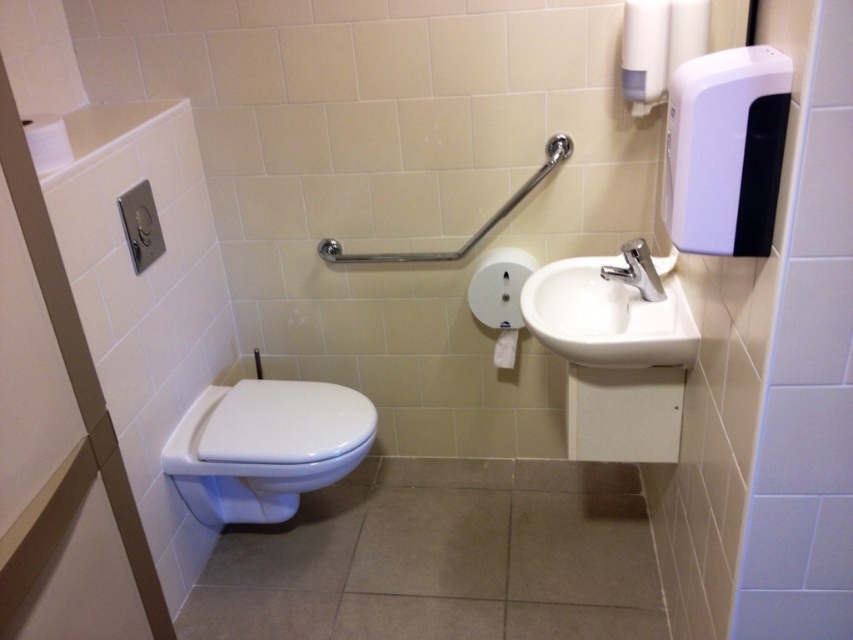
In the scene shown: Does silver metallic faucet at upper right have a lesser width compared to white matte toilet paper at center?

In fact, silver metallic faucet at upper right might be wider than white matte toilet paper at center.

Is point (614, 276) in front of point (494, 349)?

Yes, point (614, 276) is closer to viewer.

In order to click on silver metallic faucet at upper right in this screenshot , I will do `click(636, 269)`.

Between white glossy bidet at lower left and white matte toilet paper at center, which one has more height?

With more height is white glossy bidet at lower left.

Can you confirm if white glossy bidet at lower left is smaller than white matte toilet paper at center?

Incorrect, white glossy bidet at lower left is not smaller in size than white matte toilet paper at center.

Between point (207, 513) and point (509, 332), which one is positioned behind?

The point (509, 332) is more distant.

Where is `white glossy bidet at lower left`? The image size is (853, 640). white glossy bidet at lower left is located at coordinates (265, 448).

At what (x,y) coordinates should I click in order to perform the action: click on white glossy bidet at lower left. Please return your answer as a coordinate pair (x, y). Looking at the image, I should click on (265, 448).

Between point (258, 396) and point (621, 294), which one is positioned behind?

Point (258, 396)

Is point (303, 401) less distant than point (602, 342)?

No, it is behind (602, 342).

Image resolution: width=853 pixels, height=640 pixels. I want to click on white glossy bidet at lower left, so click(265, 448).